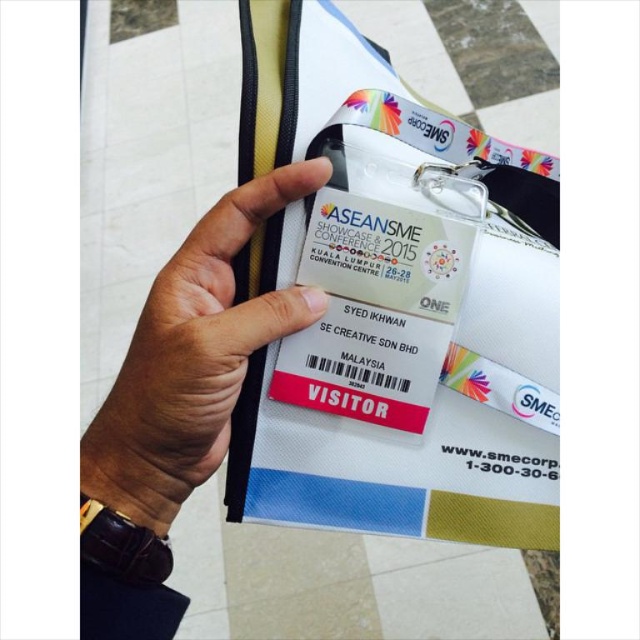
Question: Does white fabric badge at center lie in front of brown leather wristwatch at center?

Choices:
 (A) no
 (B) yes

Answer: (A)

Question: Where is white fabric badge at center located in relation to brown leather wristwatch at center in the image?

Choices:
 (A) above
 (B) below

Answer: (A)

Question: Is white fabric badge at center to the left of brown leather wristwatch at center from the viewer's perspective?

Choices:
 (A) no
 (B) yes

Answer: (A)

Question: Among these points, which one is farthest from the camera?

Choices:
 (A) (132, 460)
 (B) (513, 492)

Answer: (B)

Question: Which point is closer to the camera?

Choices:
 (A) white fabric badge at center
 (B) brown leather wristwatch at center

Answer: (B)